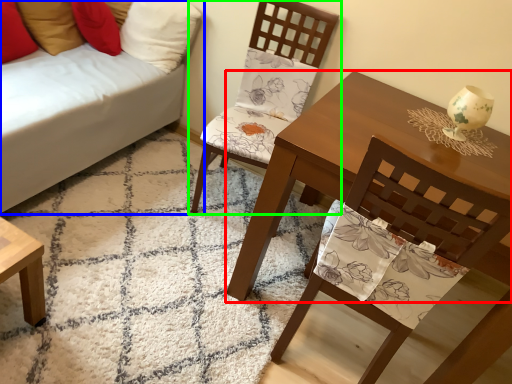
Question: Based on their relative distances, which object is nearer to table (highlighted by a red box)? Choose from studio couch (highlighted by a blue box) and chair (highlighted by a green box).

Choices:
 (A) studio couch
 (B) chair

Answer: (B)